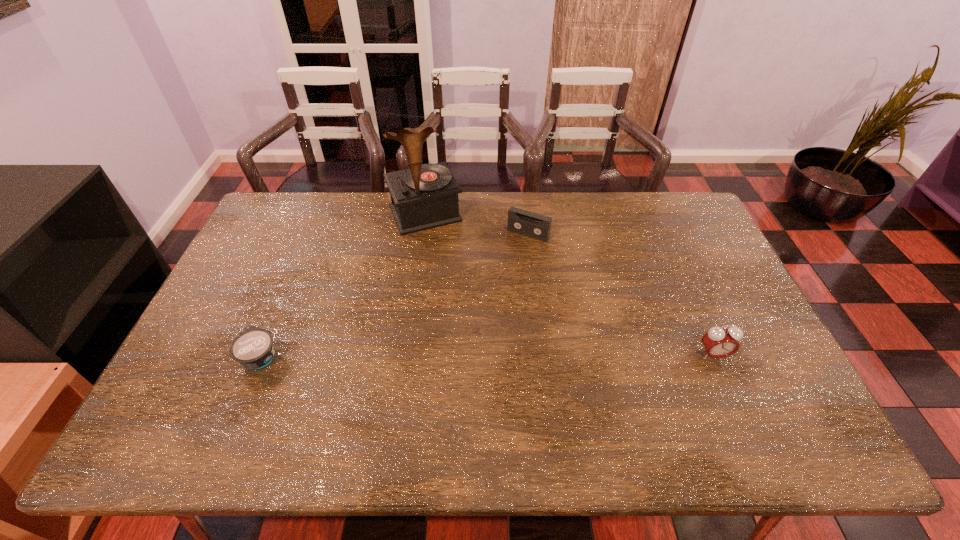
Identify the location of vacant space on the desktop that is between the shortest object and the rightmost object and is positioned on the front-facing side of the third tallest object. The width and height of the screenshot is (960, 540). (453, 356).

Image resolution: width=960 pixels, height=540 pixels. Find the location of `vacant space on the desktop that is between the yogurt and the third shortest object and is positioned at the horn opening of the tallest object`. vacant space on the desktop that is between the yogurt and the third shortest object and is positioned at the horn opening of the tallest object is located at coordinates (492, 355).